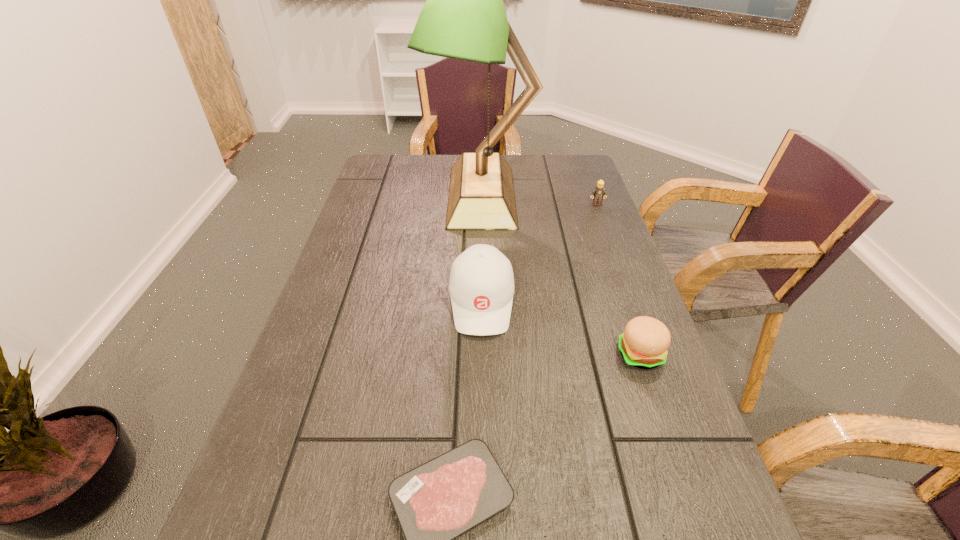
Locate an element on the screen. This screenshot has height=540, width=960. object at the far edge is located at coordinates (464, 17).

Image resolution: width=960 pixels, height=540 pixels. In order to click on hamburger located at the right edge in this screenshot , I will do `click(643, 344)`.

This screenshot has width=960, height=540. Find the location of `Lego located at the right edge`. Lego located at the right edge is located at coordinates (599, 192).

The width and height of the screenshot is (960, 540). What are the coordinates of `vacant space at the far edge of the desktop` in the screenshot? It's located at (428, 185).

In the image, there is a desktop. At what (x,y) coordinates should I click in order to perform the action: click on free space at the left edge. Please return your answer as a coordinate pair (x, y). Looking at the image, I should click on (376, 335).

This screenshot has height=540, width=960. In the image, there is a desktop. In order to click on vacant space at the right edge in this screenshot , I will do `click(655, 442)`.

Identify the location of blank space at the far left corner of the desktop. (392, 165).

Locate an element on the screen. The image size is (960, 540). blank space at the far right corner of the desktop is located at coordinates (585, 157).

Identify the location of empty location between the hamburger and the table lamp. (562, 275).

This screenshot has width=960, height=540. I want to click on blank region between the tallest object and the hamburger, so click(x=562, y=275).